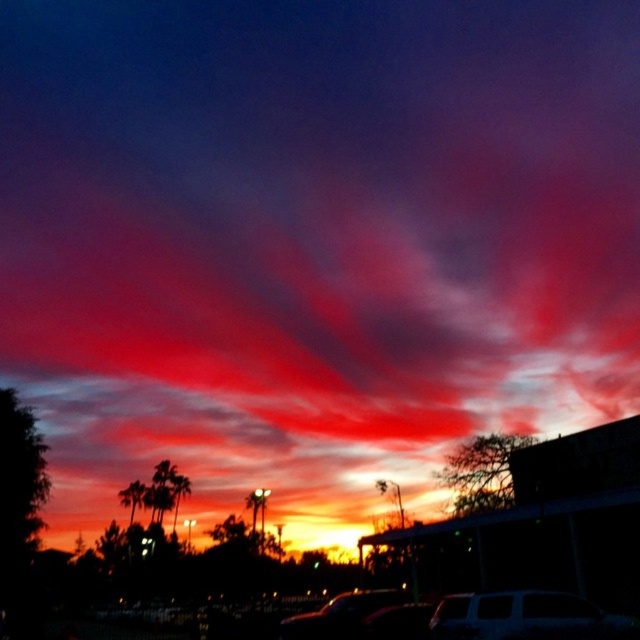
Question: Which of the following is the closest to the observer?

Choices:
 (A) matte white van at lower center
 (B) shiny black car at center

Answer: (A)

Question: Which point is closer to the camera taking this photo?

Choices:
 (A) (481, 628)
 (B) (332, 611)

Answer: (A)

Question: Can you confirm if matte white van at lower center is smaller than shiny black car at center?

Choices:
 (A) yes
 (B) no

Answer: (A)

Question: Does matte white van at lower center have a lesser width compared to shiny black car at center?

Choices:
 (A) no
 (B) yes

Answer: (B)

Question: Observing the image, what is the correct spatial positioning of matte white van at lower center in reference to shiny black car at center?

Choices:
 (A) below
 (B) above

Answer: (B)